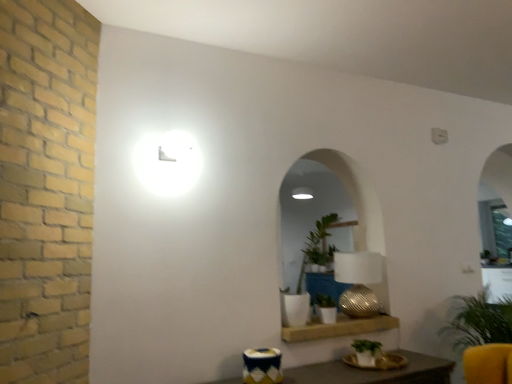
Question: From a real-world perspective, does green leafy plant at right, positioned as the fourth houseplant in left-to-right order, stand above green matte plant at lower center, the second houseplant from the right?

Choices:
 (A) no
 (B) yes

Answer: (A)

Question: Does green leafy plant at right, which appears as the first houseplant when viewed from the right, have a smaller size compared to green matte plant at lower center, which appears as the 3th houseplant when viewed from the left?

Choices:
 (A) no
 (B) yes

Answer: (A)

Question: Considering the relative sizes of green leafy plant at right, positioned as the fourth houseplant in left-to-right order, and green matte plant at lower center, which appears as the 3th houseplant when viewed from the left, in the image provided, is green leafy plant at right, positioned as the fourth houseplant in left-to-right order, shorter than green matte plant at lower center, which appears as the 3th houseplant when viewed from the left,?

Choices:
 (A) no
 (B) yes

Answer: (A)

Question: Could you tell me if green leafy plant at right, which appears as the first houseplant when viewed from the right, is facing green matte plant at lower center, the second houseplant from the right?

Choices:
 (A) no
 (B) yes

Answer: (A)

Question: From the image's perspective, is green leafy plant at right, which appears as the first houseplant when viewed from the right, below green matte plant at lower center, which appears as the 3th houseplant when viewed from the left?

Choices:
 (A) no
 (B) yes

Answer: (B)

Question: Is textured gold table lamp at center in front of or behind green matte plant at center, placed as the 3th houseplant when sorted from right to left, in the image?

Choices:
 (A) behind
 (B) front

Answer: (A)

Question: Based on their positions, is textured gold table lamp at center located to the left or right of green matte plant at center, which appears as the 2th houseplant when viewed from the left?

Choices:
 (A) left
 (B) right

Answer: (B)

Question: Considering the positions of point (370, 306) and point (321, 297), is point (370, 306) closer or farther from the camera than point (321, 297)?

Choices:
 (A) closer
 (B) farther

Answer: (B)

Question: In terms of height, does textured gold table lamp at center look taller or shorter compared to green matte plant at center, placed as the 3th houseplant when sorted from right to left?

Choices:
 (A) short
 (B) tall

Answer: (B)

Question: From the image's perspective, is textured gold table lamp at center above or below white ceramic plant at center, which is the fourth houseplant in right-to-left order?

Choices:
 (A) above
 (B) below

Answer: (B)

Question: Is textured gold table lamp at center taller or shorter than white ceramic plant at center, the 1th houseplant from the left?

Choices:
 (A) short
 (B) tall

Answer: (A)

Question: Is point (360, 284) positioned closer to the camera than point (298, 301)?

Choices:
 (A) closer
 (B) farther

Answer: (B)

Question: Based on their positions, is textured gold table lamp at center located to the left or right of white ceramic plant at center, which is the fourth houseplant in right-to-left order?

Choices:
 (A) right
 (B) left

Answer: (A)

Question: From the image's perspective, is green matte plant at center, placed as the 3th houseplant when sorted from right to left, above or below green matte plant at lower center, which appears as the 3th houseplant when viewed from the left?

Choices:
 (A) below
 (B) above

Answer: (B)

Question: Is point (316, 306) closer or farther from the camera than point (370, 362)?

Choices:
 (A) farther
 (B) closer

Answer: (A)